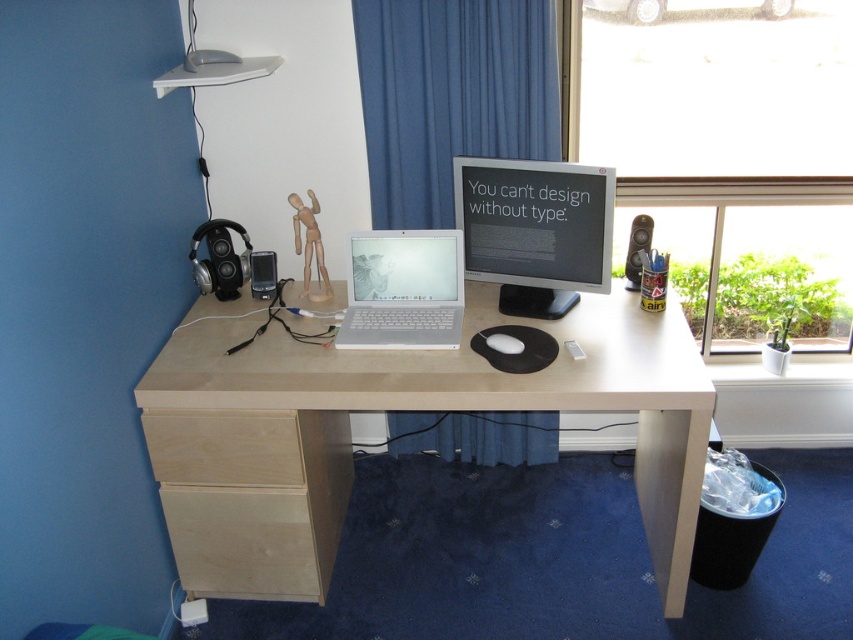
Question: Which point is farther from the camera taking this photo?

Choices:
 (A) (709, 252)
 (B) (242, 481)
 (C) (540, 296)

Answer: (A)

Question: Observing the image, what is the correct spatial positioning of transparent glass window at upper right in reference to silver metallic laptop at center?

Choices:
 (A) right
 (B) left

Answer: (A)

Question: Which of the following is the farthest from the observer?

Choices:
 (A) birch wood drawer at lower left
 (B) black plastic speaker at right
 (C) silver metallic laptop at center
 (D) blue fabric curtain at center

Answer: (B)

Question: Is satin black monitor at center closer to the viewer compared to silver metallic laptop at center?

Choices:
 (A) yes
 (B) no

Answer: (A)

Question: Which is nearer to the silver metallic laptop at center?

Choices:
 (A) blue fabric curtain at center
 (B) light wood/plywood computer desk at center
 (C) bare wood drawer at lower left
 (D) black plastic speaker at right

Answer: (B)

Question: Is blue fabric curtain at center thinner than white matte mouse at center?

Choices:
 (A) no
 (B) yes

Answer: (A)